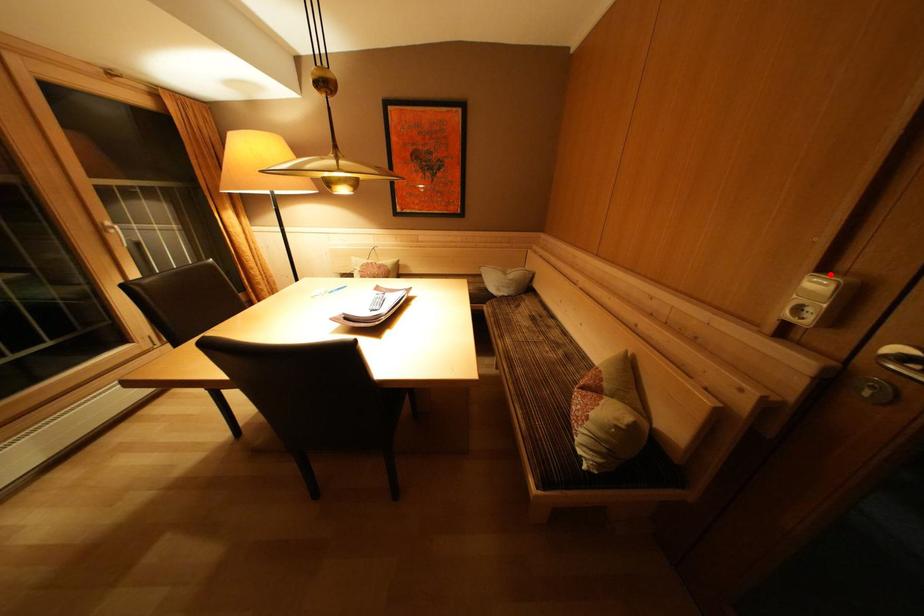
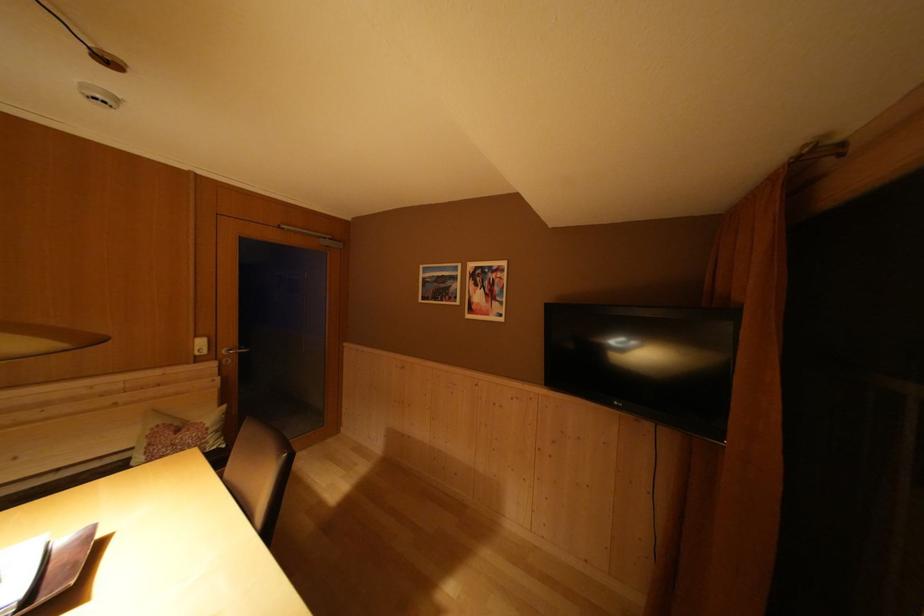
In the second image, find the point that corresponds to the highlighted location in the first image.

(203, 342)